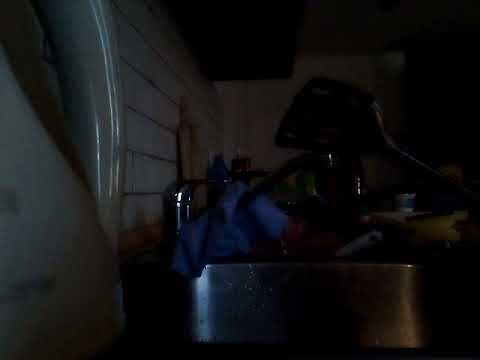
Locate an element on the screen. The width and height of the screenshot is (480, 360). rolling pin is located at coordinates pyautogui.click(x=183, y=156).